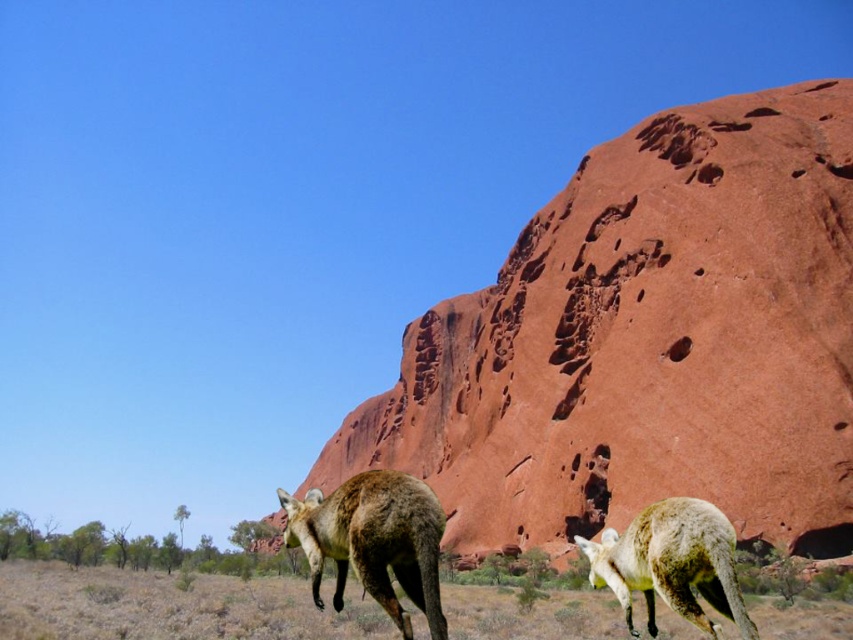
Question: Which point appears closest to the camera in this image?

Choices:
 (A) (683, 600)
 (B) (579, 308)

Answer: (A)

Question: From the image, what is the correct spatial relationship of rustic sandstone rock at center in relation to white fur kangaroo at lower right?

Choices:
 (A) right
 (B) left

Answer: (B)

Question: Is rustic sandstone rock at center to the left of white fur kangaroo at lower right from the viewer's perspective?

Choices:
 (A) no
 (B) yes

Answer: (B)

Question: Which of the following is the farthest from the observer?

Choices:
 (A) white fur kangaroo at lower right
 (B) rustic sandstone rock at center

Answer: (B)

Question: From the image, what is the correct spatial relationship of brown fur kangaroo at center in relation to white fur kangaroo at lower right?

Choices:
 (A) below
 (B) above

Answer: (A)

Question: Which of the following is the closest to the observer?

Choices:
 (A) (711, 540)
 (B) (422, 417)

Answer: (A)